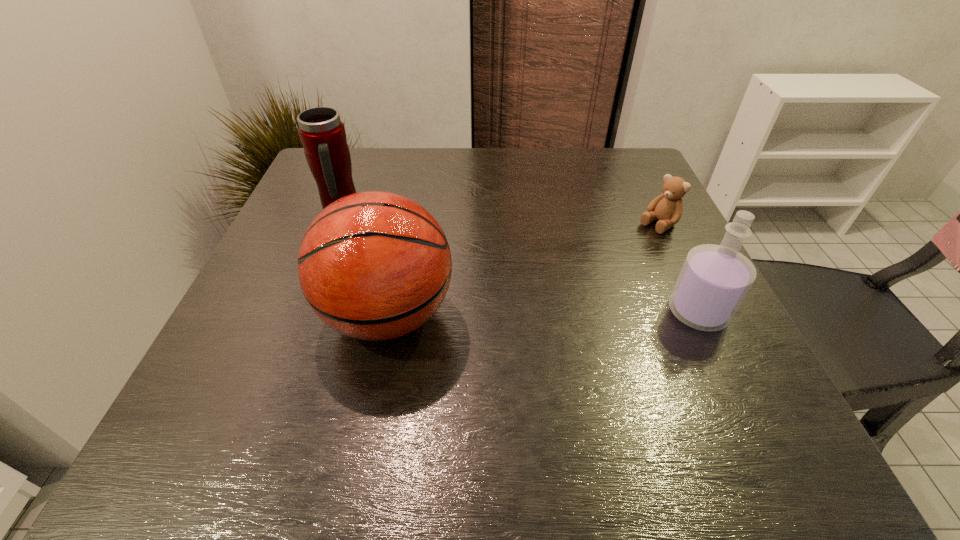
Find the location of `free point between the thermos bottle and the perfume`. free point between the thermos bottle and the perfume is located at coordinates (518, 260).

The height and width of the screenshot is (540, 960). I want to click on free area in between the perfume and the teddy bear, so click(678, 268).

Locate an element on the screen. Image resolution: width=960 pixels, height=540 pixels. free space between the thermos bottle and the teddy bear is located at coordinates (498, 216).

You are a GUI agent. You are given a task and a screenshot of the screen. Output one action in this format:
    pyautogui.click(x=<x>, y=<y>)
    Task: Click on the free spot between the perfume and the thermos bottle
    
    Given the screenshot: What is the action you would take?
    pyautogui.click(x=518, y=260)

Find the location of a particular element. The width and height of the screenshot is (960, 540). vacant area between the thermos bottle and the teddy bear is located at coordinates (498, 216).

You are a GUI agent. You are given a task and a screenshot of the screen. Output one action in this format:
    pyautogui.click(x=<x>, y=<y>)
    Task: Click on the vacant space that's between the teddy bear and the thermos bottle
    
    Given the screenshot: What is the action you would take?
    pyautogui.click(x=498, y=216)

Locate an element on the screen. The height and width of the screenshot is (540, 960). free spot between the perfume and the basketball is located at coordinates (542, 314).

The height and width of the screenshot is (540, 960). Identify the location of vacant space that's between the perfume and the basketball. (542, 314).

This screenshot has height=540, width=960. Find the location of `object that can be found as the second closest to the perfume`. object that can be found as the second closest to the perfume is located at coordinates (374, 265).

Where is `object that is the closest to the teddy bear`? The width and height of the screenshot is (960, 540). object that is the closest to the teddy bear is located at coordinates (714, 279).